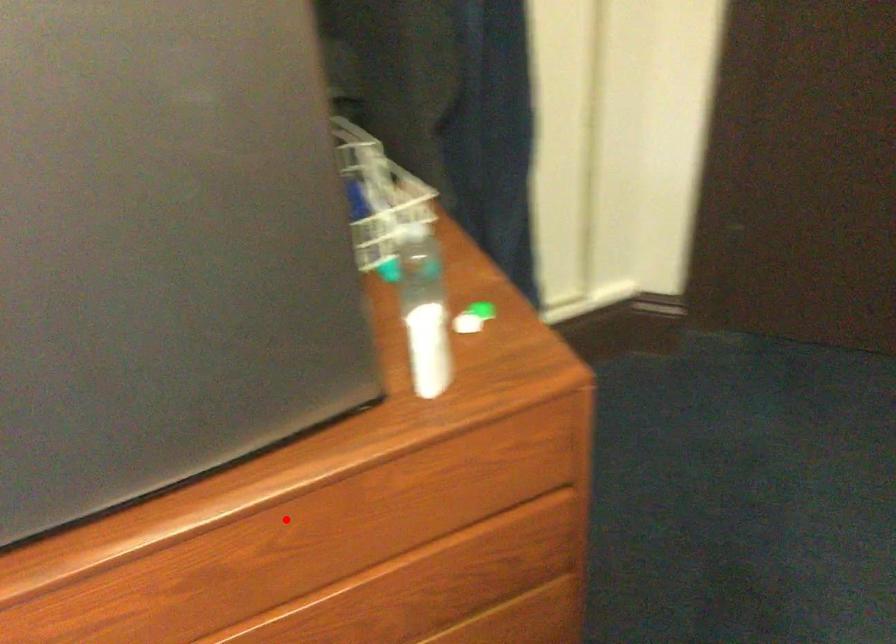
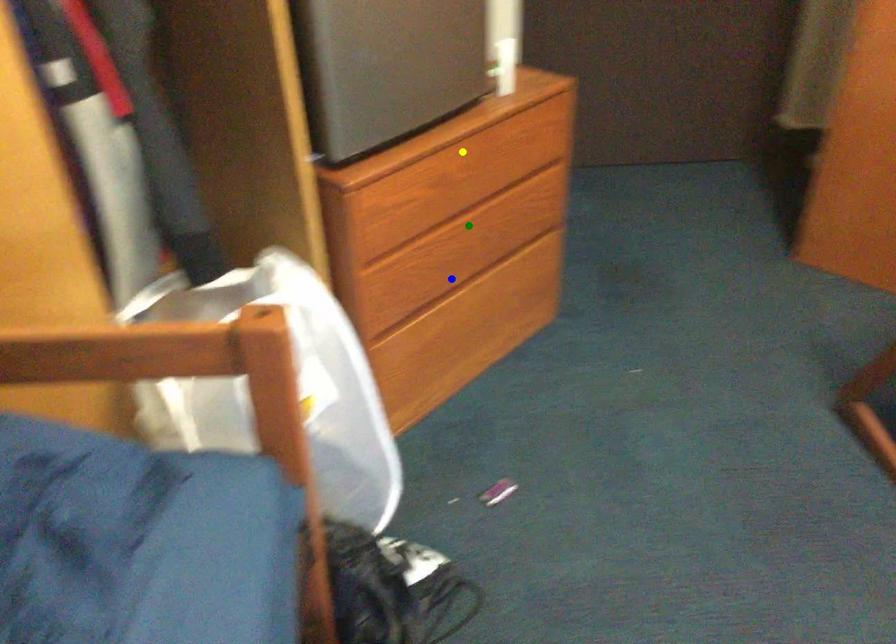
Question: I am providing you with two images of the same scene from different viewpoints. A red point is marked on the first image. You are given multiple points on the second image. Can you choose the point in image 2 that corresponds to the point in image 1?

Choices:
 (A) green point
 (B) yellow point
 (C) blue point

Answer: (B)